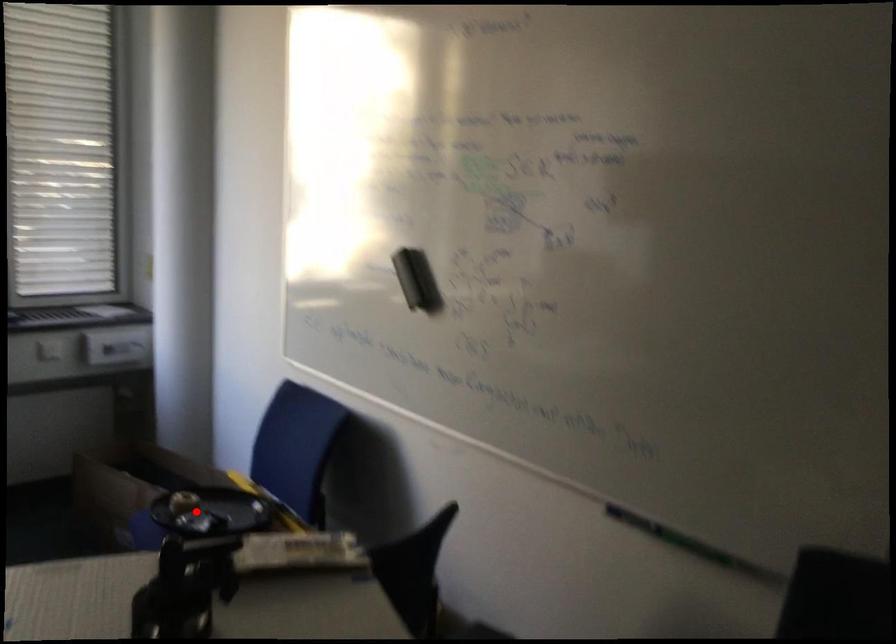
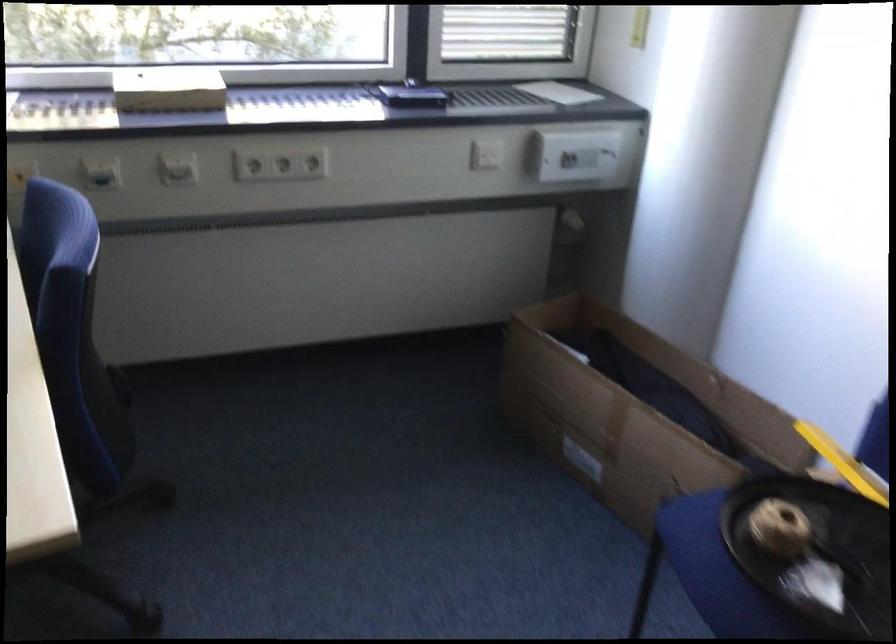
Question: I am providing you with two images of the same scene from different viewpoints. A red point is shown in image1. For the corresponding object point in image2, is it positioned nearer or farther from the camera?

Choices:
 (A) Nearer
 (B) Farther

Answer: (A)